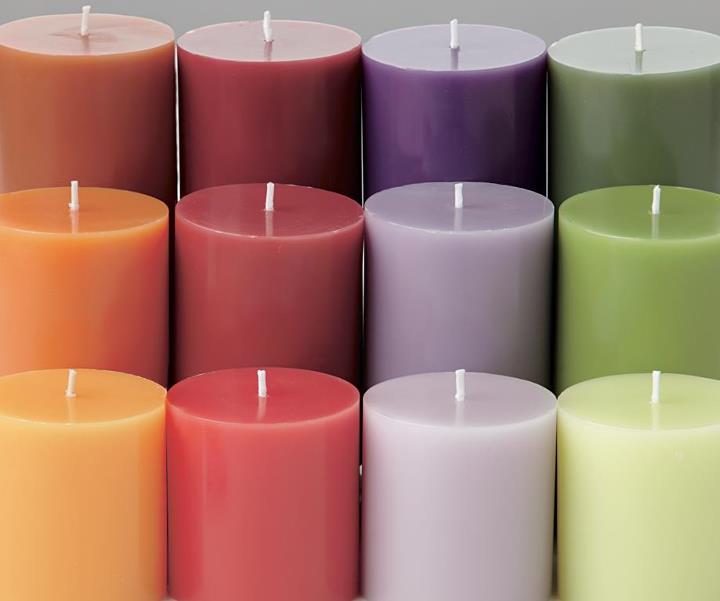
Locate an element on the screen. This screenshot has width=720, height=601. candles in bottom row is located at coordinates (63, 514), (260, 505), (463, 516), (652, 511).